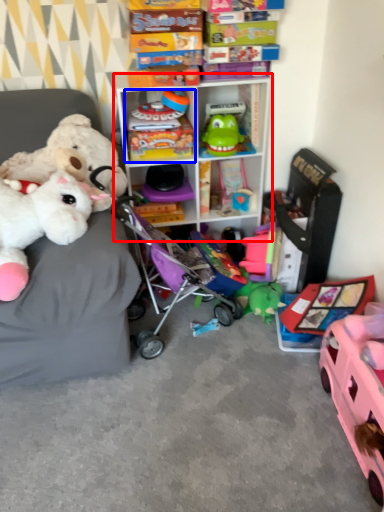
Question: Which of the following is the farthest to the observer, shelf (highlighted by a red box) or toy (highlighted by a blue box)?

Choices:
 (A) shelf
 (B) toy

Answer: (B)